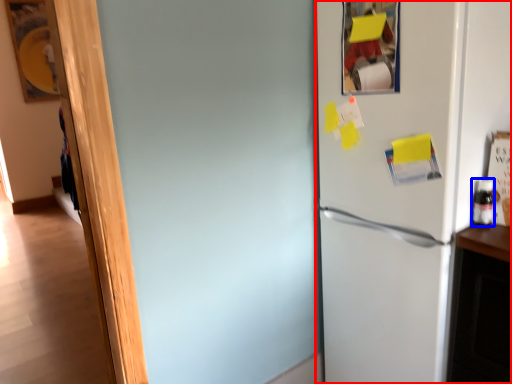
Question: Among these objects, which one is farthest to the camera, refrigerator (highlighted by a red box) or bottle (highlighted by a blue box)?

Choices:
 (A) refrigerator
 (B) bottle

Answer: (B)